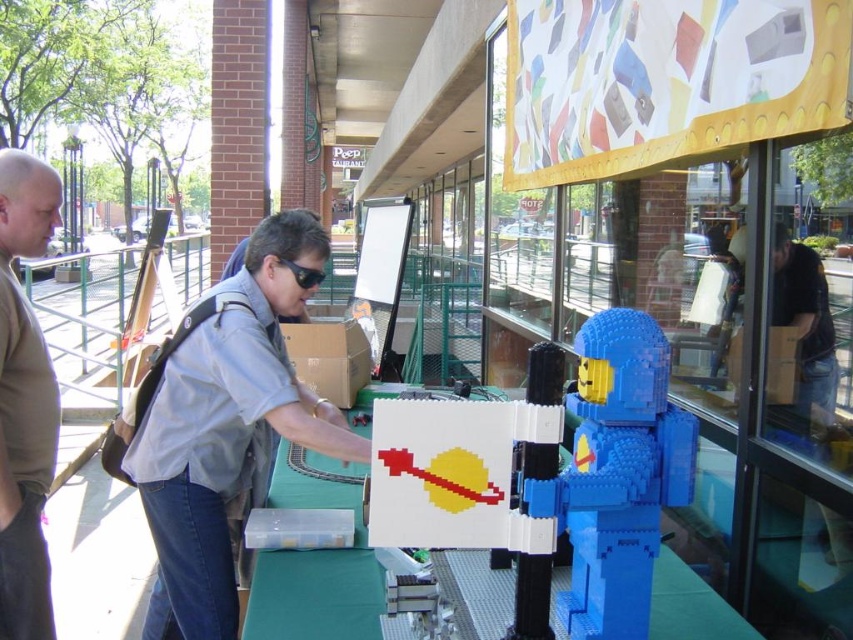
You are a fashion designer observing the person assembling LEGO. Which item, the matte khaki shirt at left or the black plastic goggles at center, is taller when viewed from the front?

The matte khaki shirt at left has a greater height compared to the black plastic goggles at center, so the matte khaki shirt at left is taller.

You are a photographer trying to capture a photo of the cardboard box at upper right without including the matte khaki shirt at left in the frame. Based on their positions, is this possible?

The matte khaki shirt at left is to the left of the cardboard box at upper right, so if you position yourself to the right side of the scene, you can capture the cardboard box at upper right without including the matte khaki shirt at left in the frame.

You are a photographer standing behind the person assembling the LEGO structure. You want to capture a closeup shot of the blue plastic toy at center and the light blue shirt at center. Which object should you focus on first if you want to ensure both are in focus without adjusting your camera settings?

The light blue shirt at center should be focused on first because it is closer to the camera than the blue plastic toy at center, ensuring both will be in focus if the camera is set to focus on the closer object.